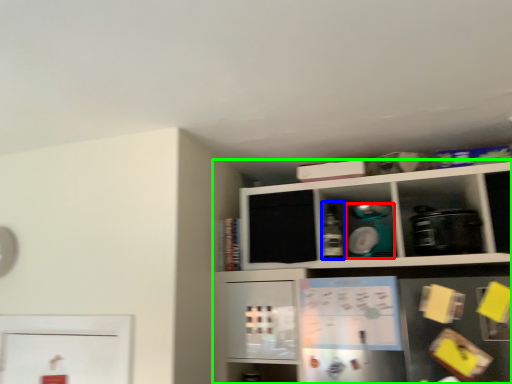
Question: Based on their relative distances, which object is farther from appliance (highlighted by a red box)? Choose from bottle (highlighted by a blue box) and shelf (highlighted by a green box).

Choices:
 (A) bottle
 (B) shelf

Answer: (B)